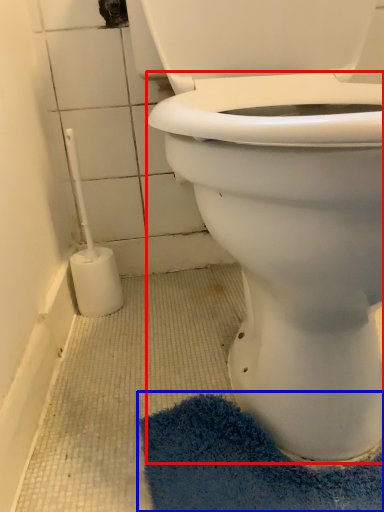
Question: Which object is further to the camera taking this photo, bidet (highlighted by a red box) or bath mat (highlighted by a blue box)?

Choices:
 (A) bidet
 (B) bath mat

Answer: (B)